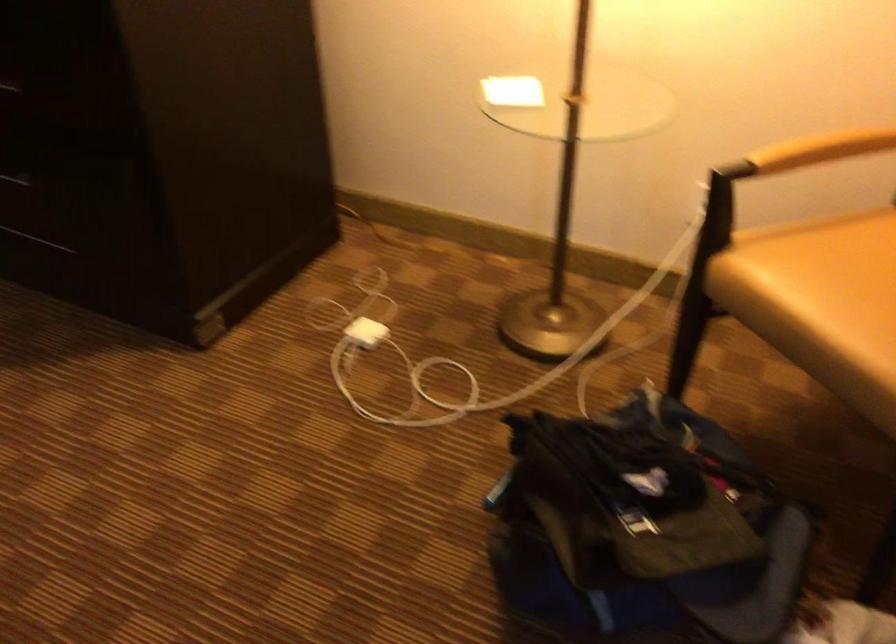
Find where to sit the chair sitting surface. Please return your answer as a coordinate pair (x, y).

(821, 303)